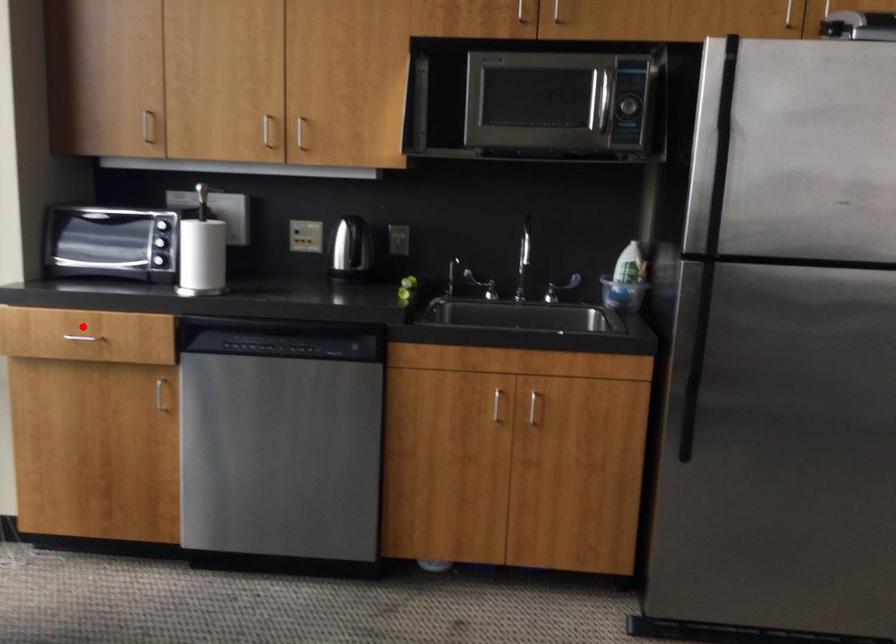
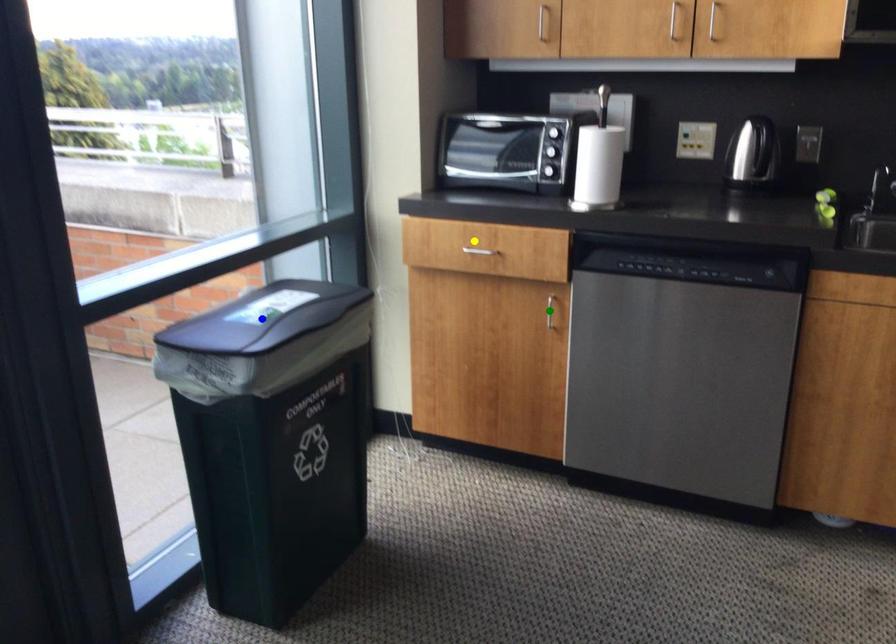
Question: I am providing you with two images of the same scene from different viewpoints. A red point is marked on the first image. You are given multiple points on the second image. Can you choose the point in image 2 that corresponds to the point in image 1?

Choices:
 (A) green point
 (B) blue point
 (C) yellow point

Answer: (C)